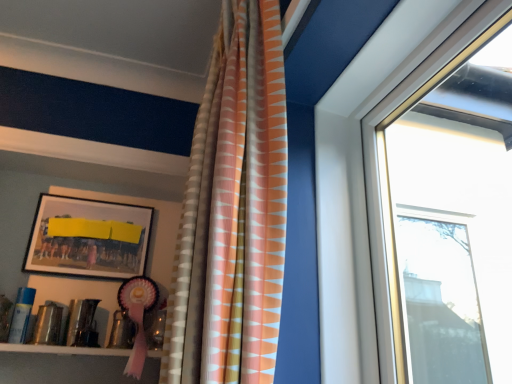
Where is `matte black picture frame at upper left`? matte black picture frame at upper left is located at coordinates (88, 238).

Describe the element at coordinates (88, 238) in the screenshot. This screenshot has height=384, width=512. I see `matte black picture frame at upper left` at that location.

Image resolution: width=512 pixels, height=384 pixels. In order to click on textured orange and white curtain at center in this screenshot , I will do `click(234, 210)`.

What do you see at coordinates (234, 210) in the screenshot?
I see `textured orange and white curtain at center` at bounding box center [234, 210].

Image resolution: width=512 pixels, height=384 pixels. I want to click on matte black picture frame at upper left, so click(88, 238).

Is matte black picture frame at upper left to the right of textured orange and white curtain at center from the viewer's perspective?

In fact, matte black picture frame at upper left is to the left of textured orange and white curtain at center.

Considering the relative positions of matte black picture frame at upper left and textured orange and white curtain at center in the image provided, is matte black picture frame at upper left in front of textured orange and white curtain at center?

No, matte black picture frame at upper left is further to the viewer.

Which is in front, point (116, 240) or point (174, 336)?

Positioned in front is point (174, 336).

From the image's perspective, is matte black picture frame at upper left above or below textured orange and white curtain at center?

matte black picture frame at upper left is situated lower than textured orange and white curtain at center in the image.

From a real-world perspective, which is physically below, matte black picture frame at upper left or textured orange and white curtain at center?

In real-world perspective, textured orange and white curtain at center is lower.

Which of these two, matte black picture frame at upper left or textured orange and white curtain at center, is wider?

With larger width is textured orange and white curtain at center.

Who is taller, matte black picture frame at upper left or textured orange and white curtain at center?

Standing taller between the two is textured orange and white curtain at center.

Considering the relative sizes of matte black picture frame at upper left and textured orange and white curtain at center in the image provided, is matte black picture frame at upper left smaller than textured orange and white curtain at center?

Indeed, matte black picture frame at upper left has a smaller size compared to textured orange and white curtain at center.

Would you say matte black picture frame at upper left is inside or outside textured orange and white curtain at center?

matte black picture frame at upper left exists outside the volume of textured orange and white curtain at center.

Does matte black picture frame at upper left touch textured orange and white curtain at center?

matte black picture frame at upper left and textured orange and white curtain at center are clearly separated.

Is matte black picture frame at upper left facing away from textured orange and white curtain at center?

That's not correct — matte black picture frame at upper left is not looking away from textured orange and white curtain at center.

Can you tell me how much matte black picture frame at upper left and textured orange and white curtain at center differ in facing direction?

The facing directions of matte black picture frame at upper left and textured orange and white curtain at center are 88.6 degrees apart.

This screenshot has height=384, width=512. Identify the location of curtain in front of the matte black picture frame at upper left. (234, 210).

Which object is positioned more to the left, textured orange and white curtain at center or matte black picture frame at upper left?

matte black picture frame at upper left.

Is the depth of textured orange and white curtain at center less than that of matte black picture frame at upper left?

That is True.

Does point (208, 104) come farther from viewer compared to point (58, 247)?

No, (208, 104) is closer to viewer.

From the image's perspective, is textured orange and white curtain at center above or below matte black picture frame at upper left?

textured orange and white curtain at center is above matte black picture frame at upper left.

From a real-world perspective, which is physically above, textured orange and white curtain at center or matte black picture frame at upper left?

From a 3D spatial view, matte black picture frame at upper left is above.

Which of these two, textured orange and white curtain at center or matte black picture frame at upper left, is thinner?

Thinner between the two is matte black picture frame at upper left.

Considering the sizes of textured orange and white curtain at center and matte black picture frame at upper left in the image, is textured orange and white curtain at center taller or shorter than matte black picture frame at upper left?

In the image, textured orange and white curtain at center appears to be taller than matte black picture frame at upper left.

Considering the sizes of textured orange and white curtain at center and matte black picture frame at upper left in the image, is textured orange and white curtain at center bigger or smaller than matte black picture frame at upper left?

In the image, textured orange and white curtain at center appears to be larger than matte black picture frame at upper left.

Can matte black picture frame at upper left be found inside textured orange and white curtain at center?

Actually, matte black picture frame at upper left is outside textured orange and white curtain at center.

Is textured orange and white curtain at center with matte black picture frame at upper left?

textured orange and white curtain at center and matte black picture frame at upper left are clearly separated.

Is textured orange and white curtain at center positioned with its back to matte black picture frame at upper left?

No, textured orange and white curtain at center is not facing away from matte black picture frame at upper left.

How many degrees apart are the facing directions of textured orange and white curtain at center and matte black picture frame at upper left?

The facing directions of textured orange and white curtain at center and matte black picture frame at upper left are 88.6 degrees apart.

Where is `curtain below the matte black picture frame at upper left (from a real-world perspective)`? The height and width of the screenshot is (384, 512). curtain below the matte black picture frame at upper left (from a real-world perspective) is located at coordinates 234,210.

The image size is (512, 384). Find the location of `picture frame on the left of textured orange and white curtain at center`. picture frame on the left of textured orange and white curtain at center is located at coordinates (88, 238).

Locate an element on the screen. This screenshot has height=384, width=512. picture frame behind the textured orange and white curtain at center is located at coordinates (88, 238).